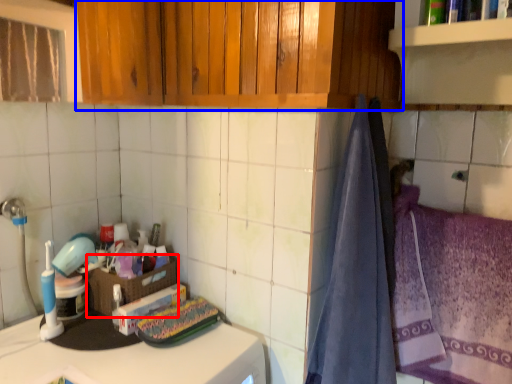
Question: Which object appears farthest to the camera in this image, basket (highlighted by a red box) or cabinetry (highlighted by a blue box)?

Choices:
 (A) basket
 (B) cabinetry

Answer: (A)